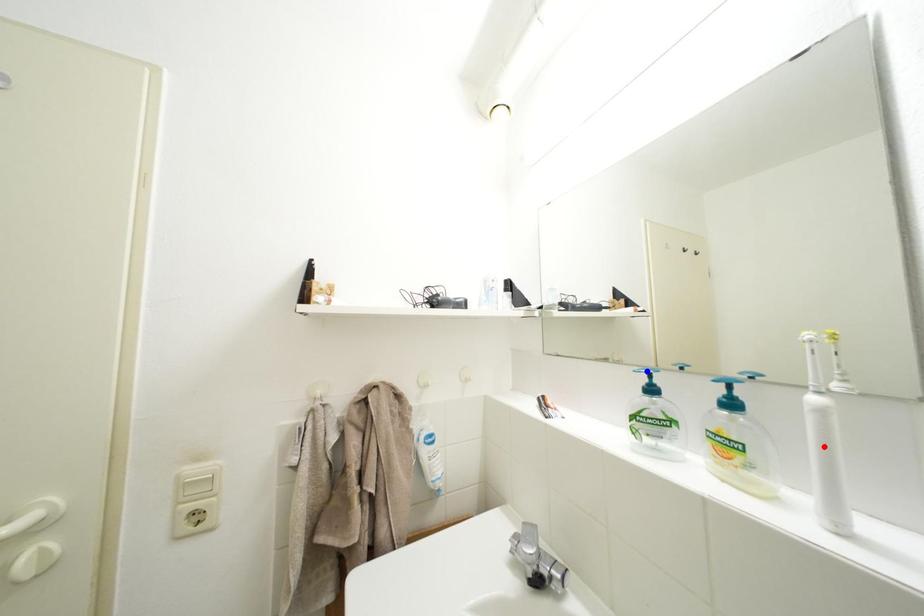
Question: Two points are marked on the image. Which point is closer to the camera?

Choices:
 (A) Blue point is closer.
 (B) Red point is closer.

Answer: (B)